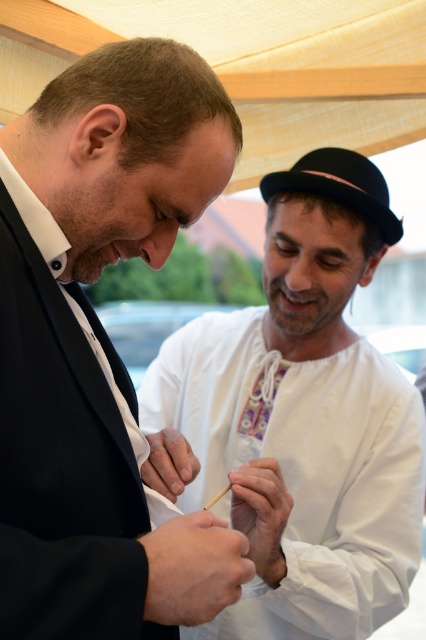
You are a photographer at a cultural event and need to capture a clear photo of both the black matte suit at center and the embroidered fabric tie at center. Which object should you focus on first to ensure it appears in focus in the final image?

The black matte suit at center is much taller than the embroidered fabric tie at center, so you should focus on the black matte suit at center first to ensure proper depth of field and clarity.

Based on the scene description, where is the white embroidered shirt at center located in terms of its 2D coordinates?

The white embroidered shirt at center is located at the 2D coordinates point (305, 417).